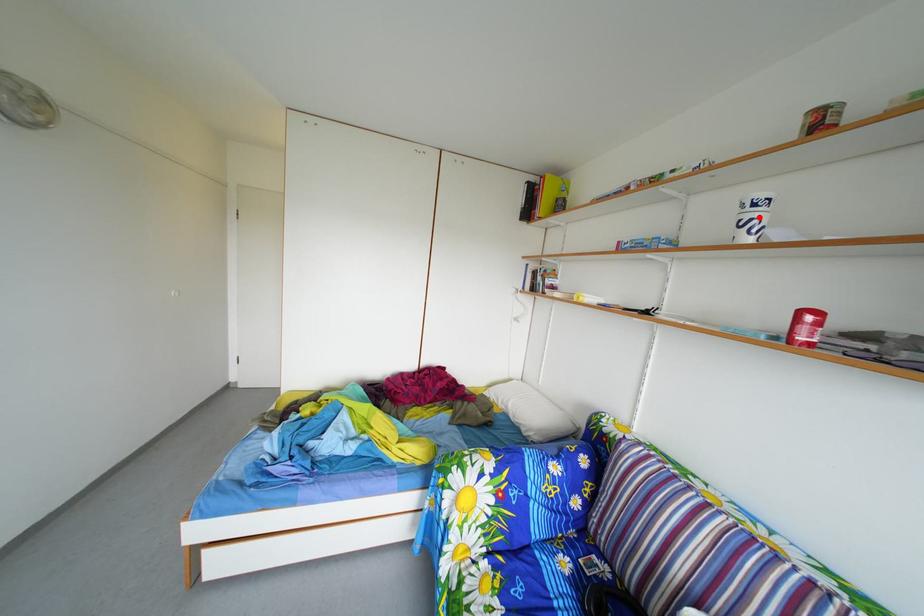
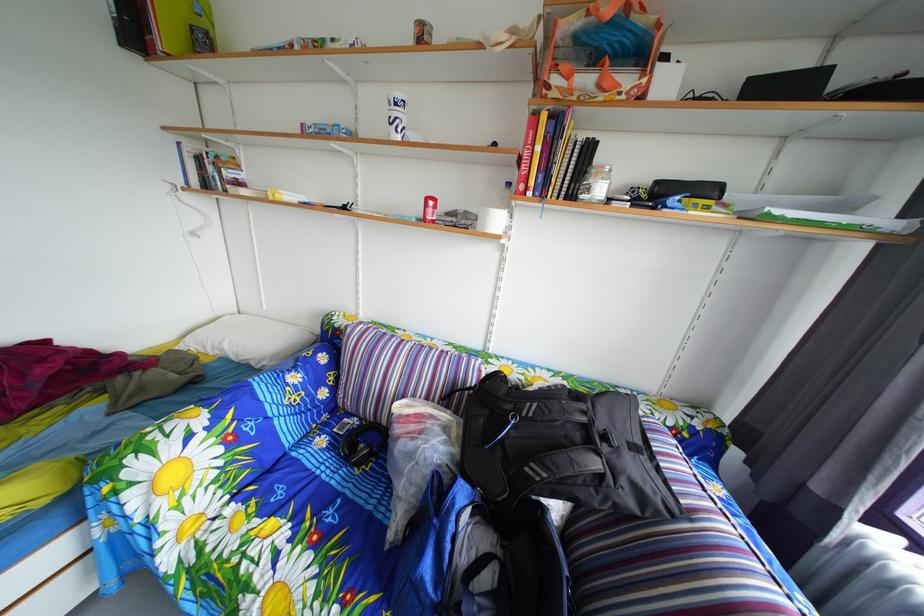
Find the pixel in the second image that matches the highlighted location in the first image.

(404, 116)